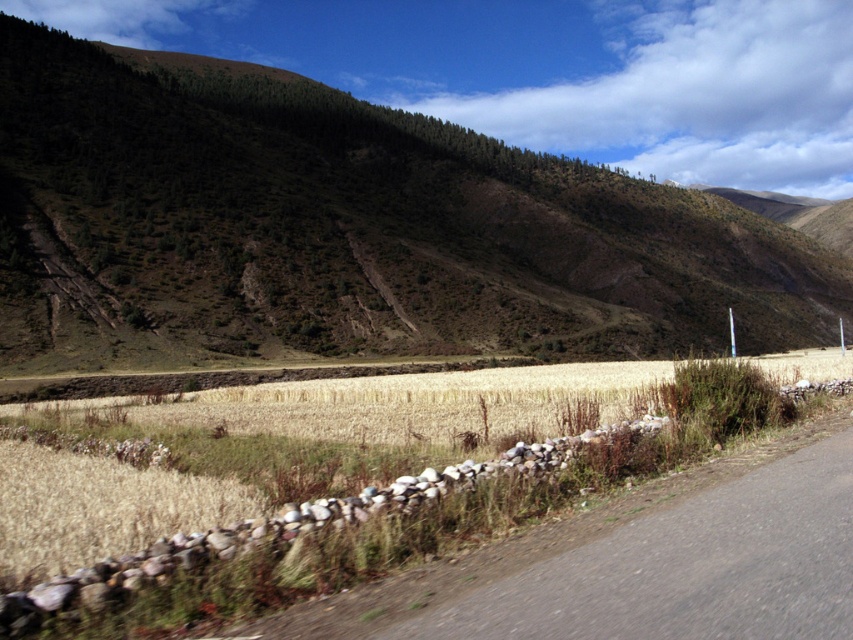
Question: Considering the real-world distances, which object is farthest from the gray asphalt road at lower right?

Choices:
 (A) green textured hillside at upper left
 (B) golden grain field at center

Answer: (A)

Question: Can you confirm if green textured hillside at upper left is smaller than golden grain field at center?

Choices:
 (A) no
 (B) yes

Answer: (A)

Question: Which object is farther from the camera taking this photo?

Choices:
 (A) green textured hillside at upper left
 (B) gray asphalt road at lower right
 (C) golden grain field at center

Answer: (A)

Question: Considering the real-world distances, which object is closest to the gray asphalt road at lower right?

Choices:
 (A) green textured hillside at upper left
 (B) golden grain field at center

Answer: (B)

Question: Is green textured hillside at upper left positioned before gray asphalt road at lower right?

Choices:
 (A) yes
 (B) no

Answer: (B)

Question: Does green textured hillside at upper left have a lesser width compared to gray asphalt road at lower right?

Choices:
 (A) no
 (B) yes

Answer: (A)